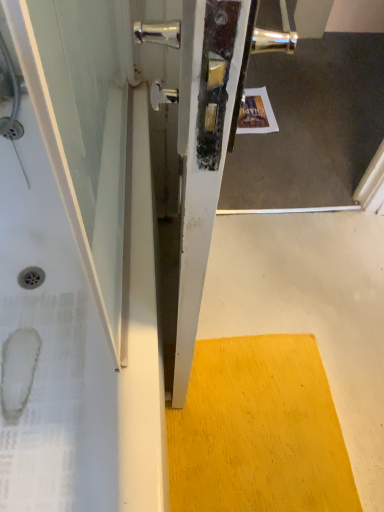
Question: Considering the positions of yellow textured mat at lower center and white glossy bathtub at left in the image, is yellow textured mat at lower center wider or thinner than white glossy bathtub at left?

Choices:
 (A) thin
 (B) wide

Answer: (A)

Question: Considering the positions of yellow textured mat at lower center and white glossy bathtub at left in the image, is yellow textured mat at lower center taller or shorter than white glossy bathtub at left?

Choices:
 (A) tall
 (B) short

Answer: (B)

Question: From the image's perspective, is yellow textured mat at lower center located above or below white glossy bathtub at left?

Choices:
 (A) above
 (B) below

Answer: (B)

Question: From their relative heights in the image, would you say white glossy bathtub at left is taller or shorter than yellow textured mat at lower center?

Choices:
 (A) short
 (B) tall

Answer: (B)

Question: Looking at their shapes, would you say white glossy bathtub at left is wider or thinner than yellow textured mat at lower center?

Choices:
 (A) wide
 (B) thin

Answer: (A)

Question: From the image's perspective, is white glossy bathtub at left located above or below yellow textured mat at lower center?

Choices:
 (A) below
 (B) above

Answer: (B)

Question: In terms of size, does white glossy bathtub at left appear bigger or smaller than yellow textured mat at lower center?

Choices:
 (A) small
 (B) big

Answer: (B)